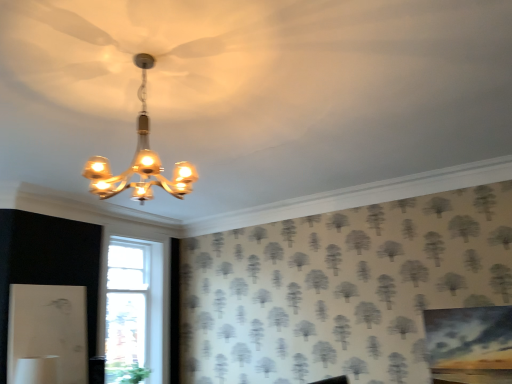
Question: Based on their sizes in the image, would you say matte gold chandelier at upper center is bigger or smaller than green leafy plant at lower left?

Choices:
 (A) big
 (B) small

Answer: (A)

Question: In terms of width, does matte gold chandelier at upper center look wider or thinner when compared to green leafy plant at lower left?

Choices:
 (A) thin
 (B) wide

Answer: (B)

Question: Which is correct: matte gold chandelier at upper center is inside green leafy plant at lower left, or outside of it?

Choices:
 (A) inside
 (B) outside

Answer: (B)

Question: In the image, is green leafy plant at lower left on the left side or the right side of matte gold chandelier at upper center?

Choices:
 (A) left
 (B) right

Answer: (A)

Question: Relative to matte gold chandelier at upper center, is green leafy plant at lower left in front or behind?

Choices:
 (A) front
 (B) behind

Answer: (B)

Question: Would you say green leafy plant at lower left is inside or outside matte gold chandelier at upper center?

Choices:
 (A) inside
 (B) outside

Answer: (B)

Question: Does point (141, 375) appear closer or farther from the camera than point (145, 152)?

Choices:
 (A) closer
 (B) farther

Answer: (B)